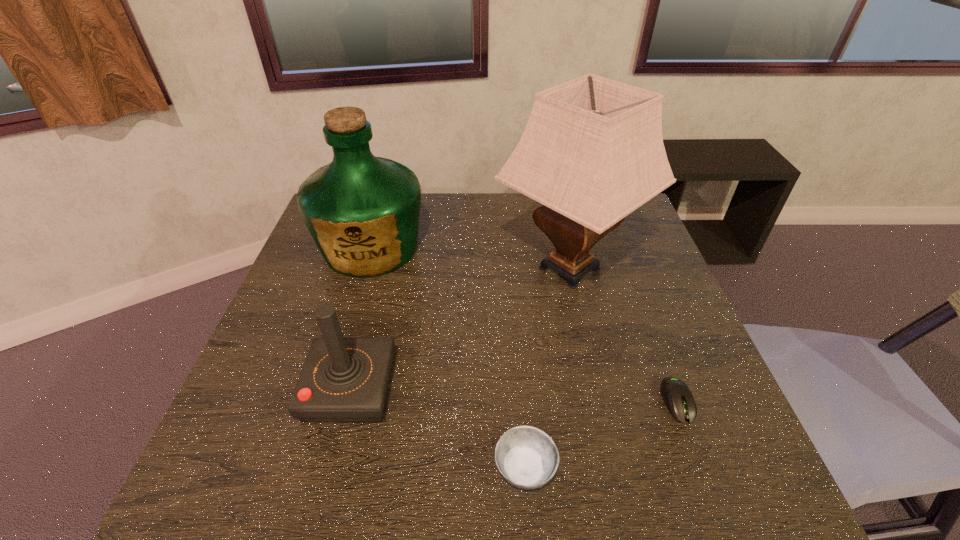
Locate an element on the screen. This screenshot has height=540, width=960. free space at the far edge of the desktop is located at coordinates [x=537, y=227].

In the image, there is a desktop. Identify the location of vacant space at the near edge. The image size is (960, 540). (378, 497).

This screenshot has width=960, height=540. I want to click on vacant region at the right edge, so click(700, 370).

Find the location of a particular element. Image resolution: width=960 pixels, height=540 pixels. free space at the near left corner of the desktop is located at coordinates (245, 491).

Identify the location of vacant region at the near right corner of the desktop. This screenshot has height=540, width=960. (756, 472).

The width and height of the screenshot is (960, 540). What are the coordinates of `empty space that is in between the computer mouse and the second tallest object` in the screenshot? It's located at (524, 325).

Where is `free space between the liquor and the tallest object`? The width and height of the screenshot is (960, 540). free space between the liquor and the tallest object is located at coordinates (470, 258).

Locate an element on the screen. free spot between the tallest object and the nearest object is located at coordinates (547, 368).

Locate an element on the screen. free space between the computer mouse and the fourth shortest object is located at coordinates (524, 325).

I want to click on vacant region between the tallest object and the shortest object, so click(x=623, y=335).